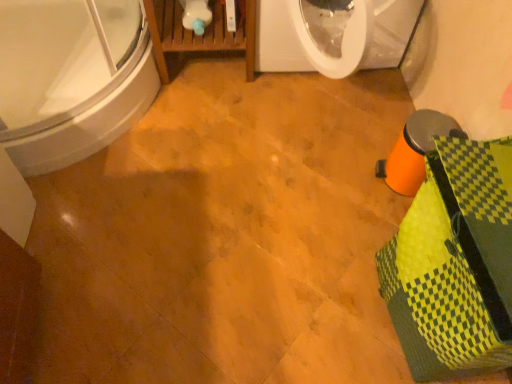
Identify the location of white glossy bathtub at upper left. The width and height of the screenshot is (512, 384). (71, 78).

Describe the element at coordinates (71, 78) in the screenshot. I see `white glossy bathtub at upper left` at that location.

Image resolution: width=512 pixels, height=384 pixels. What are the coordinates of `yellow-green woven basket at lower right` in the screenshot? It's located at (454, 263).

Measure the distance between yellow-green woven basket at lower right and camera.

yellow-green woven basket at lower right is 28.55 inches from camera.

What do you see at coordinates (454, 263) in the screenshot? I see `yellow-green woven basket at lower right` at bounding box center [454, 263].

Where is `white glossy bathtub at upper left`? white glossy bathtub at upper left is located at coordinates (71, 78).

In the image, is white glossy bathtub at upper left on the left side or the right side of yellow-green woven basket at lower right?

white glossy bathtub at upper left is positioned on yellow-green woven basket at lower right's left side.

Relative to yellow-green woven basket at lower right, is white glossy bathtub at upper left in front or behind?

Visually, white glossy bathtub at upper left is located behind yellow-green woven basket at lower right.

Is point (126, 111) farther from viewer compared to point (420, 297)?

That is True.

From the image's perspective, which one is positioned lower, white glossy bathtub at upper left or yellow-green woven basket at lower right?

yellow-green woven basket at lower right, from the image's perspective.

From a real-world perspective, which is physically above, white glossy bathtub at upper left or yellow-green woven basket at lower right?

From a 3D spatial view, yellow-green woven basket at lower right is above.

Is white glossy bathtub at upper left wider or thinner than yellow-green woven basket at lower right?

Considering their sizes, white glossy bathtub at upper left looks broader than yellow-green woven basket at lower right.

Considering the sizes of objects white glossy bathtub at upper left and yellow-green woven basket at lower right in the image provided, who is taller, white glossy bathtub at upper left or yellow-green woven basket at lower right?

Standing taller between the two is yellow-green woven basket at lower right.

Does white glossy bathtub at upper left have a smaller size compared to yellow-green woven basket at lower right?

Incorrect, white glossy bathtub at upper left is not smaller in size than yellow-green woven basket at lower right.

Choose the correct answer: Is white glossy bathtub at upper left inside yellow-green woven basket at lower right or outside it?

white glossy bathtub at upper left lies outside yellow-green woven basket at lower right.

Is there a large distance between white glossy bathtub at upper left and yellow-green woven basket at lower right?

white glossy bathtub at upper left is far away from yellow-green woven basket at lower right.

Does white glossy bathtub at upper left turn towards yellow-green woven basket at lower right?

No, white glossy bathtub at upper left is not facing towards yellow-green woven basket at lower right.

How many degrees apart are the facing directions of white glossy bathtub at upper left and yellow-green woven basket at lower right?

89.9 degrees separate the facing orientations of white glossy bathtub at upper left and yellow-green woven basket at lower right.

How far apart are white glossy bathtub at upper left and yellow-green woven basket at lower right?

4.03 feet.

Locate an element on the screen. material in front of the white glossy bathtub at upper left is located at coordinates (454, 263).

Is yellow-green woven basket at lower right at the left side of white glossy bathtub at upper left?

No.

Between yellow-green woven basket at lower right and white glossy bathtub at upper left, which one is positioned in front?

yellow-green woven basket at lower right is in front.

Does point (495, 369) appear closer or farther from the camera than point (17, 67)?

Point (495, 369) is closer to the camera than point (17, 67).

From the picture: From the image's perspective, between yellow-green woven basket at lower right and white glossy bathtub at upper left, who is located below?

yellow-green woven basket at lower right.

From a real-world perspective, is yellow-green woven basket at lower right located beneath white glossy bathtub at upper left?

No, from a real-world perspective, yellow-green woven basket at lower right is not under white glossy bathtub at upper left.

In the scene shown: Looking at their sizes, would you say yellow-green woven basket at lower right is wider or thinner than white glossy bathtub at upper left?

Considering their sizes, yellow-green woven basket at lower right looks slimmer than white glossy bathtub at upper left.

Considering the sizes of objects yellow-green woven basket at lower right and white glossy bathtub at upper left in the image provided, who is shorter, yellow-green woven basket at lower right or white glossy bathtub at upper left?

white glossy bathtub at upper left.

Considering the relative sizes of yellow-green woven basket at lower right and white glossy bathtub at upper left in the image provided, is yellow-green woven basket at lower right smaller than white glossy bathtub at upper left?

Indeed, yellow-green woven basket at lower right has a smaller size compared to white glossy bathtub at upper left.

Does yellow-green woven basket at lower right contain white glossy bathtub at upper left?

No, white glossy bathtub at upper left is not surrounded by yellow-green woven basket at lower right.

Is yellow-green woven basket at lower right directly adjacent to white glossy bathtub at upper left?

yellow-green woven basket at lower right and white glossy bathtub at upper left are clearly separated.

Is yellow-green woven basket at lower right facing away from white glossy bathtub at upper left?

No, white glossy bathtub at upper left is not at the back of yellow-green woven basket at lower right.

In the scene shown: Can you tell me how much yellow-green woven basket at lower right and white glossy bathtub at upper left differ in facing direction?

The angular difference between yellow-green woven basket at lower right and white glossy bathtub at upper left is 89.9 degrees.

How far apart are yellow-green woven basket at lower right and white glossy bathtub at upper left?

yellow-green woven basket at lower right and white glossy bathtub at upper left are 1.23 meters apart from each other.

Where is `material on the right of white glossy bathtub at upper left`? The image size is (512, 384). material on the right of white glossy bathtub at upper left is located at coordinates (454, 263).

At what (x,y) coordinates should I click in order to perform the action: click on material that is on the right side of white glossy bathtub at upper left. Please return your answer as a coordinate pair (x, y). Image resolution: width=512 pixels, height=384 pixels. Looking at the image, I should click on 454,263.

I want to click on bathtub behind the yellow-green woven basket at lower right, so click(71, 78).